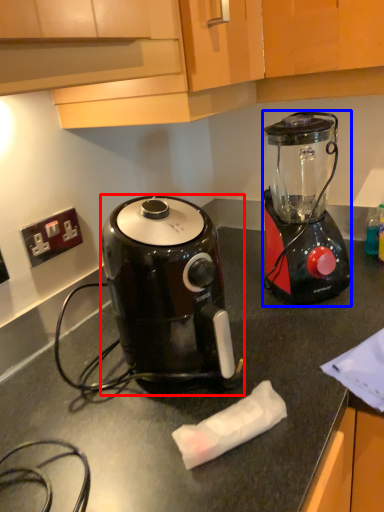
Question: Which of the following is the farthest to the observer, coffee maker (highlighted by a red box) or blender (highlighted by a blue box)?

Choices:
 (A) coffee maker
 (B) blender

Answer: (B)